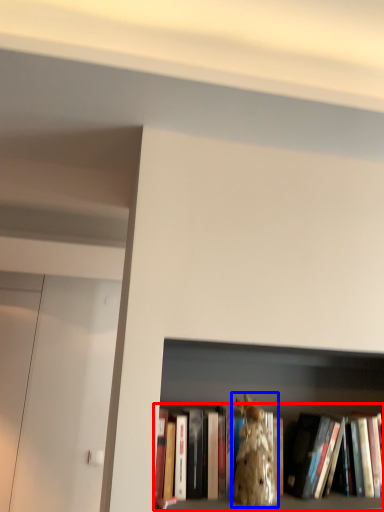
Question: Which object appears closest to the camera in this image, book (highlighted by a red box) or animal (highlighted by a blue box)?

Choices:
 (A) book
 (B) animal

Answer: (B)